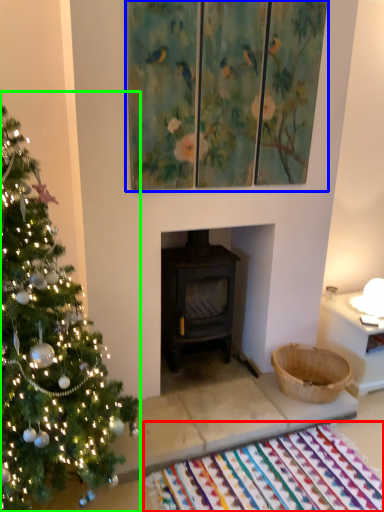
Question: Which is nearer to the mat (highlighted by a red box)? picture frame (highlighted by a blue box) or christmas tree (highlighted by a green box).

Choices:
 (A) picture frame
 (B) christmas tree

Answer: (B)